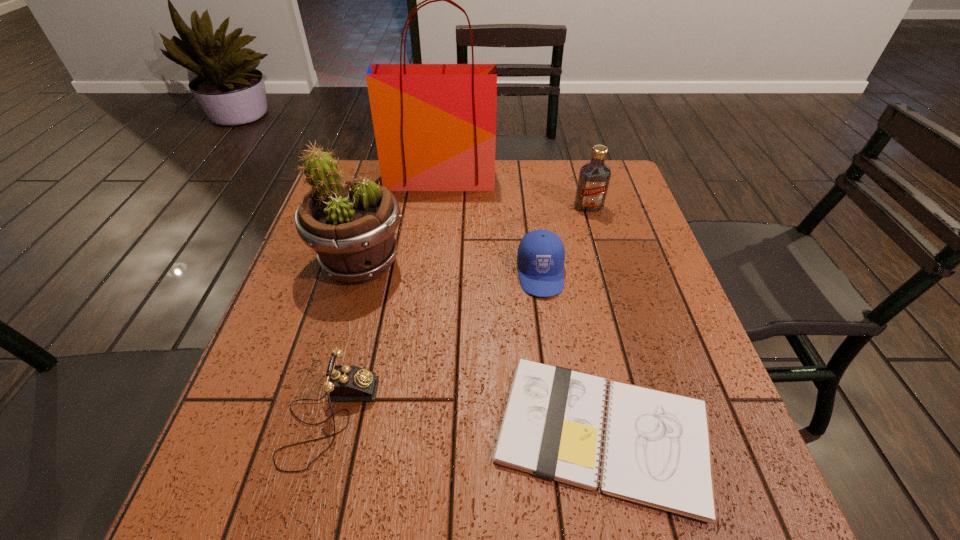
At what (x,y) coordinates should I click in order to perform the action: click on vacant region that satisfies the following two spatial constraints: 1. on the front side of the notepad; 2. on the left side of the flowerpot. Please return your answer as a coordinate pair (x, y). The width and height of the screenshot is (960, 540). Looking at the image, I should click on (313, 433).